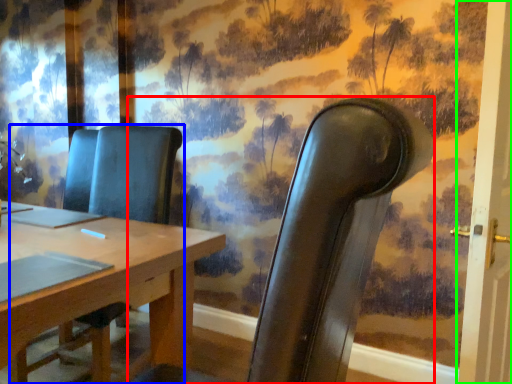
Question: Based on their relative distances, which object is nearer to chair (highlighted by a red box)? Choose from chair (highlighted by a blue box) and door (highlighted by a green box).

Choices:
 (A) chair
 (B) door

Answer: (B)